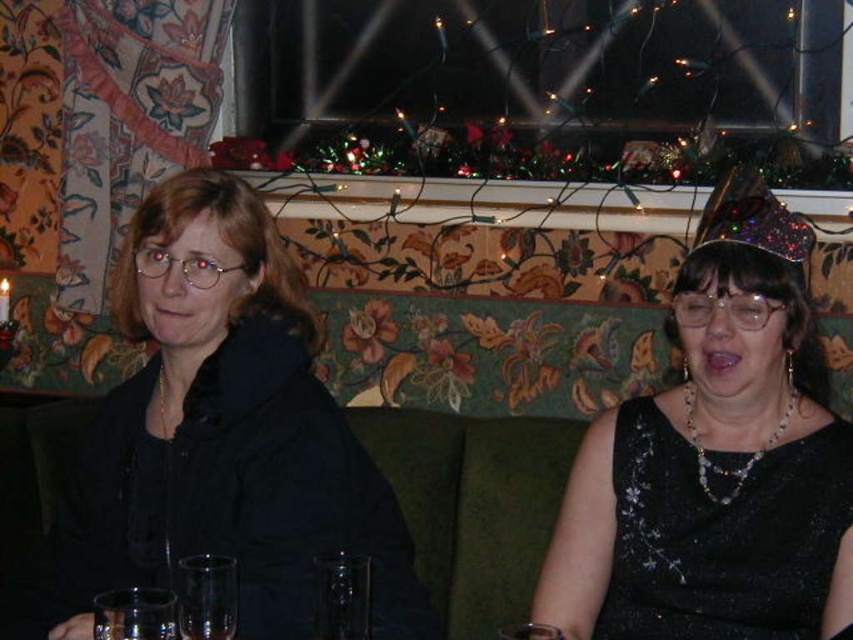
Is point (126, 627) farther from viewer compared to point (178, 614)?

No, it is in front of (178, 614).

Which is in front, point (175, 611) or point (206, 604)?

Point (206, 604) is in front.

Locate an element on the screen. clear glass wine glass at lower center is located at coordinates (134, 614).

Does black matte jacket at left have a greater width compared to clear glass wine glass at lower left?

Yes.

At what (x,y) coordinates should I click in order to perform the action: click on black matte jacket at left. Please return your answer as a coordinate pair (x, y). Looking at the image, I should click on (x=223, y=433).

Is transparent glass at center to the right of clear glass wine glass at lower center from the viewer's perspective?

Correct, you'll find transparent glass at center to the right of clear glass wine glass at lower center.

From the picture: Is transparent glass at center taller than clear glass wine glass at lower center?

Correct, transparent glass at center is much taller as clear glass wine glass at lower center.

This screenshot has height=640, width=853. In order to click on transparent glass at center in this screenshot , I will do `click(341, 596)`.

This screenshot has height=640, width=853. I want to click on transparent glass at center, so click(341, 596).